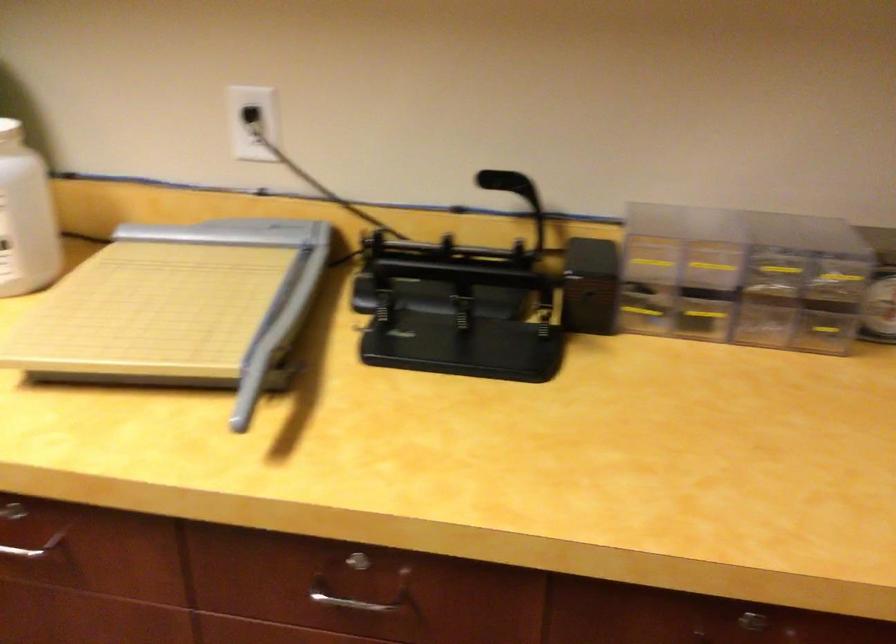
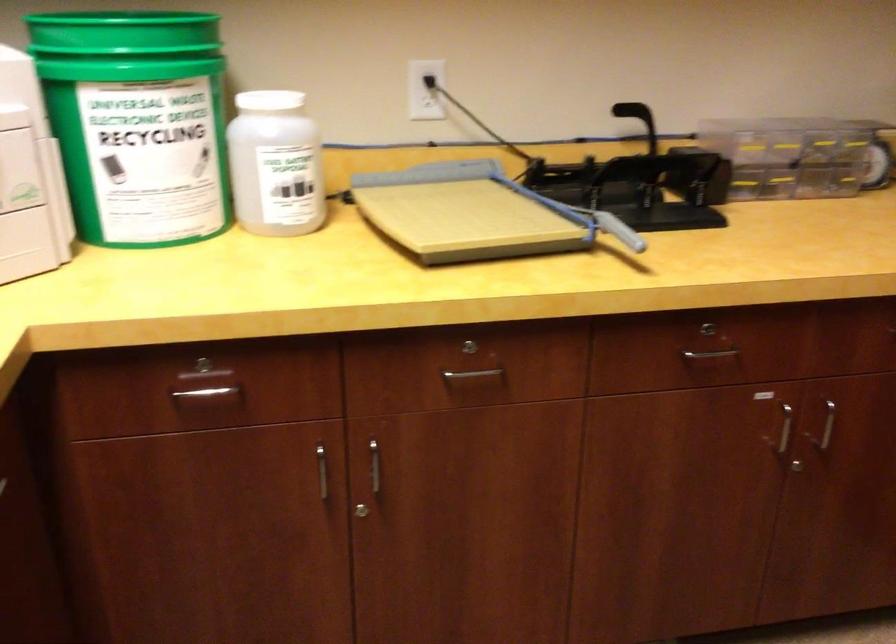
Question: How did the camera likely rotate?

Choices:
 (A) Left
 (B) Right
 (C) Up
 (D) Down

Answer: (B)